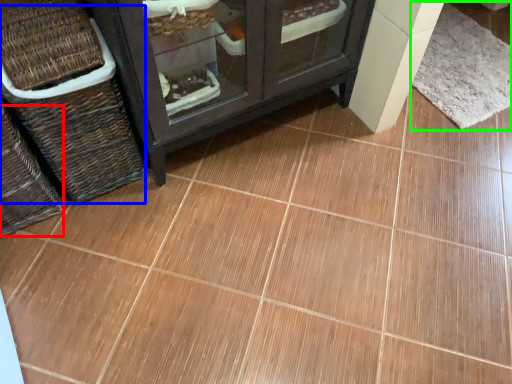
Question: Which is nearer to the basket (highlighted by a red box)? basket (highlighted by a blue box) or mat (highlighted by a green box).

Choices:
 (A) basket
 (B) mat

Answer: (A)